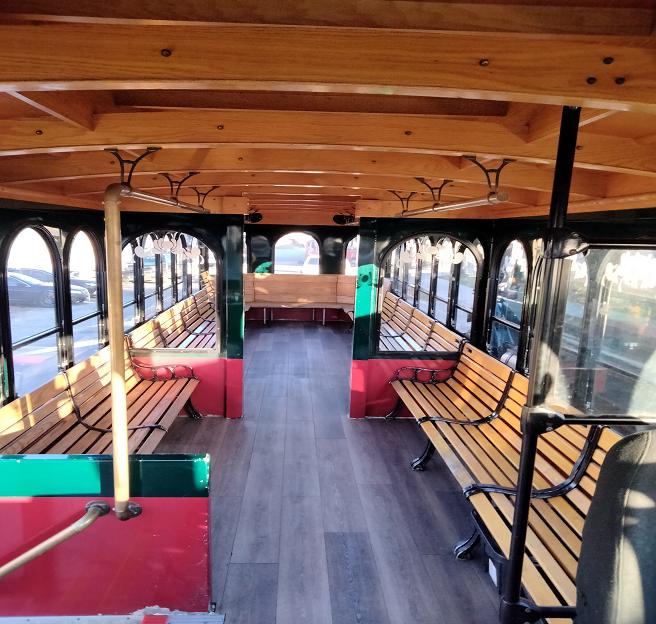
At what (x,y) coordinates should I click in order to perform the action: click on trolley floor. Please return your answer as a coordinate pair (x, y). The width and height of the screenshot is (656, 624). Looking at the image, I should click on (300, 424).